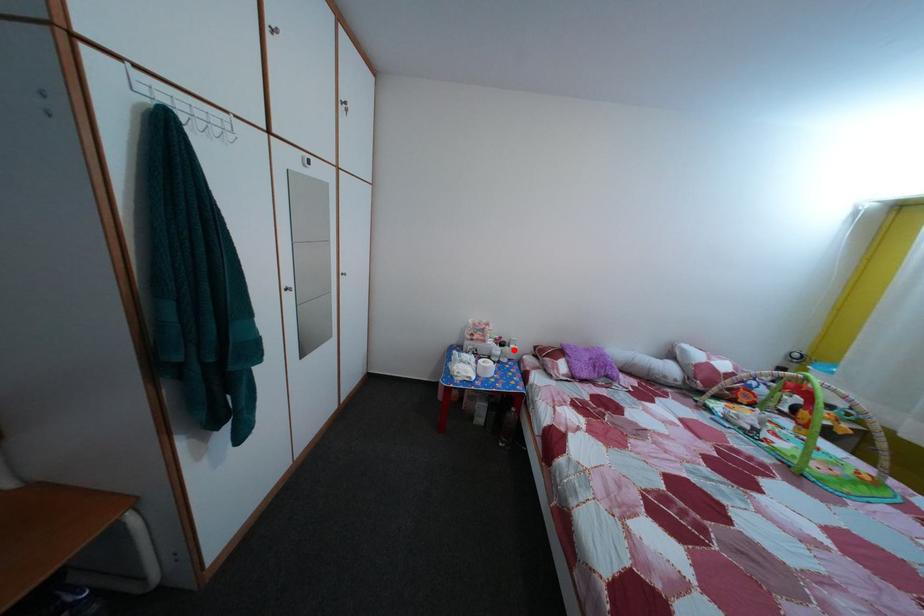
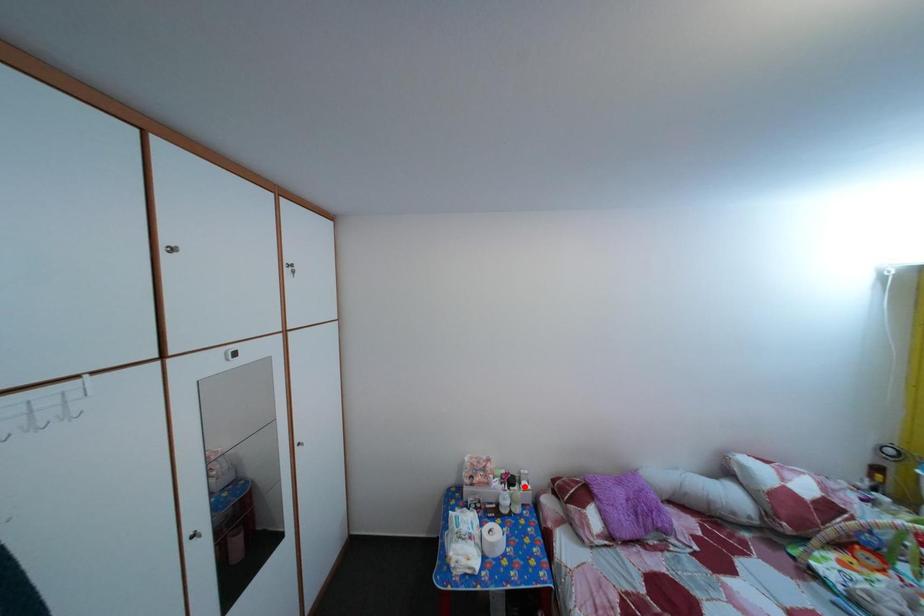
I am providing you with two images of the same scene from different viewpoints. A red point is marked on the first image and another point is marked on the second image. Is the red point in image1 aligned with the point shown in image2?

No